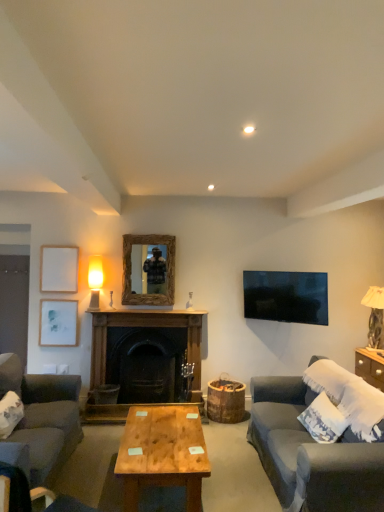
Question: From a real-world perspective, is dark gray fabric couch at lower right, marked as the 1th studio couch in a right-to-left arrangement, physically below dark gray fabric couch at lower left, which is the 2th studio couch in front-to-back order?

Choices:
 (A) no
 (B) yes

Answer: (A)

Question: From a real-world perspective, is dark gray fabric couch at lower right, which is counted as the second studio couch, starting from the back, located higher than dark gray fabric couch at lower left, which is counted as the 1th studio couch, starting from the back?

Choices:
 (A) no
 (B) yes

Answer: (B)

Question: Can you confirm if dark gray fabric couch at lower right, which is counted as the second studio couch, starting from the back, is smaller than dark gray fabric couch at lower left, which ranks as the 2th studio couch in right-to-left order?

Choices:
 (A) yes
 (B) no

Answer: (A)

Question: From the image's perspective, does dark gray fabric couch at lower right, which is counted as the second studio couch, starting from the back, appear higher than dark gray fabric couch at lower left, which ranks as the 2th studio couch in right-to-left order?

Choices:
 (A) yes
 (B) no

Answer: (A)

Question: Would you say dark gray fabric couch at lower right, which is counted as the second studio couch, starting from the back, contains dark gray fabric couch at lower left, which is the 1th studio couch from left to right?

Choices:
 (A) no
 (B) yes

Answer: (A)

Question: Would you say white textured pillow at right is inside or outside wooden-framed mirror at center?

Choices:
 (A) outside
 (B) inside

Answer: (A)

Question: Visually, is white textured pillow at right positioned to the left or to the right of wooden-framed mirror at center?

Choices:
 (A) right
 (B) left

Answer: (A)

Question: In terms of size, does white textured pillow at right appear bigger or smaller than wooden-framed mirror at center?

Choices:
 (A) small
 (B) big

Answer: (B)

Question: Does point (322, 415) appear closer or farther from the camera than point (168, 284)?

Choices:
 (A) closer
 (B) farther

Answer: (A)

Question: Looking at their shapes, would you say matte glass table lamp at upper left, marked as the first table lamp in a left-to-right arrangement, is wider or thinner than dark gray fabric chair at lower left?

Choices:
 (A) wide
 (B) thin

Answer: (B)

Question: Based on their sizes in the image, would you say matte glass table lamp at upper left, marked as the first table lamp in a left-to-right arrangement, is bigger or smaller than dark gray fabric chair at lower left?

Choices:
 (A) big
 (B) small

Answer: (B)

Question: Choose the correct answer: Is matte glass table lamp at upper left, marked as the first table lamp in a left-to-right arrangement, inside dark gray fabric chair at lower left or outside it?

Choices:
 (A) outside
 (B) inside

Answer: (A)

Question: From the image's perspective, is matte glass table lamp at upper left, marked as the first table lamp in a left-to-right arrangement, positioned above or below dark gray fabric chair at lower left?

Choices:
 (A) below
 (B) above

Answer: (B)

Question: Considering the relative positions of marble-like beige table lamp at right, which is the 1th table lamp from right to left, and white textured pillow at right in the image provided, is marble-like beige table lamp at right, which is the 1th table lamp from right to left, to the left or to the right of white textured pillow at right?

Choices:
 (A) left
 (B) right

Answer: (B)

Question: Would you say marble-like beige table lamp at right, which appears as the 2th table lamp when viewed from the left, is inside or outside white textured pillow at right?

Choices:
 (A) inside
 (B) outside

Answer: (B)